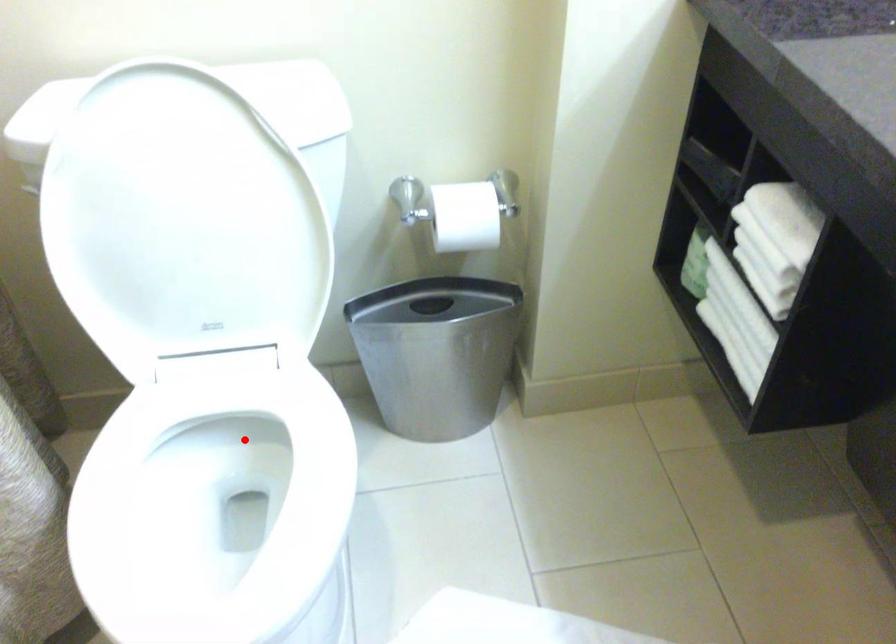
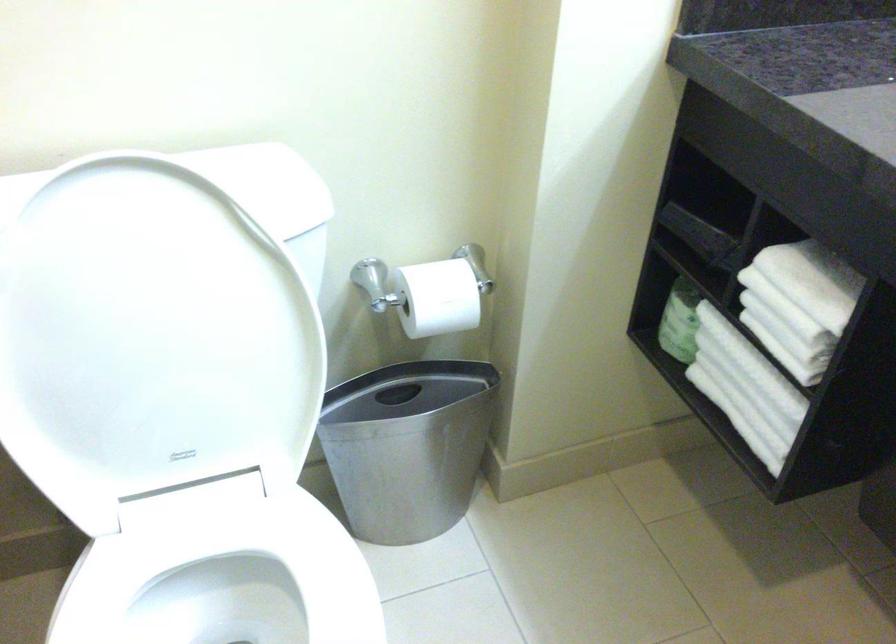
The point at the highlighted location is marked in the first image. Where is the corresponding point in the second image?

(225, 581)